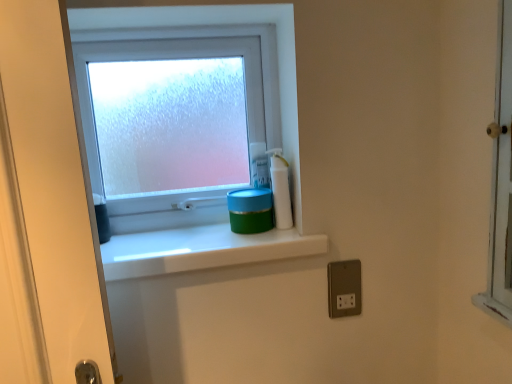
The image size is (512, 384). What are the coordinates of `vacant area that is in front of blue plastic container at upper right` in the screenshot? It's located at (256, 238).